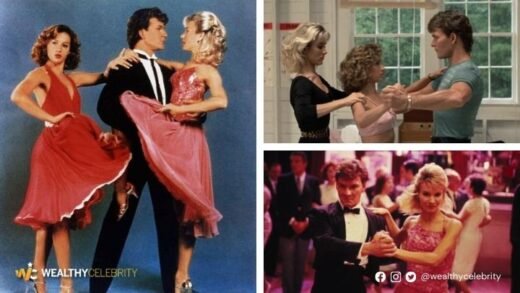
Find the location of `window`. window is located at coordinates pos(386,50), pos(476,51).